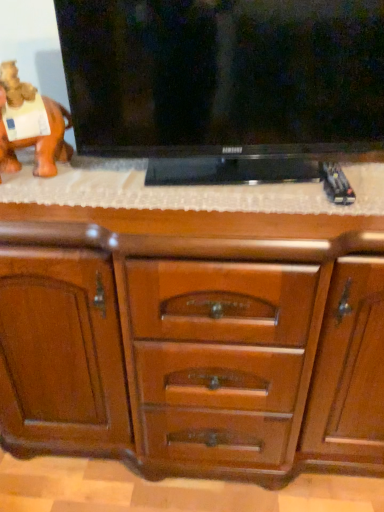
The height and width of the screenshot is (512, 384). Find the location of `vacant area on top of wooden chest of drawers at center (from a real-world perspective)`. vacant area on top of wooden chest of drawers at center (from a real-world perspective) is located at coordinates (195, 187).